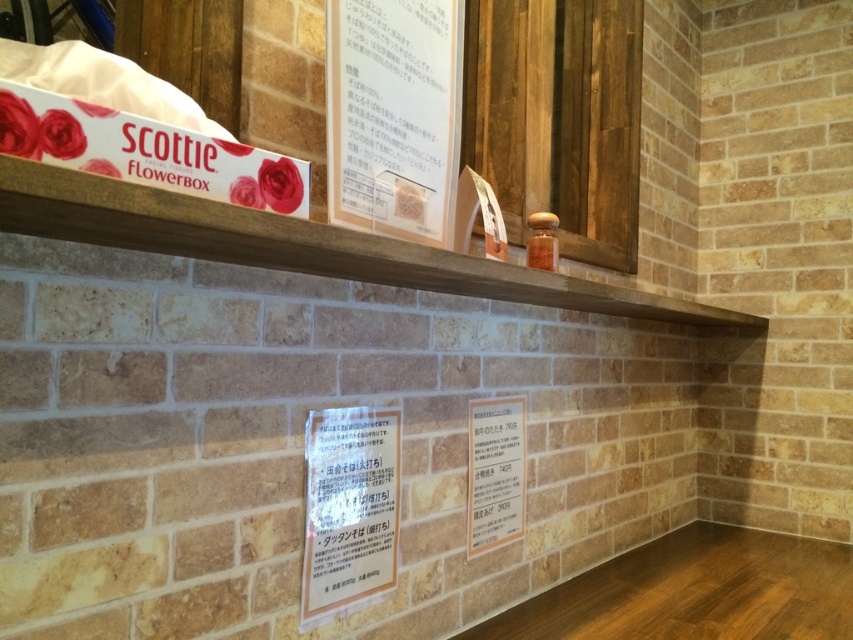
Looking at this image, you are standing in the room with the rustic brick wall. There is a wooden shelf at upper center. If you were to place a small decorative item at the point with coordinates (300, 244), where would it be placed?

The point (300, 244) corresponds to the wooden shelf at upper center, so placing the item there would position it on the wooden shelf at upper center.

You are an interior designer planning to hang a decorative mirror that is 10 inches wide between the wooden shelf at upper center and the white paper at upper center. Can the mirror fit in the space between them without overlapping either object?

The wooden shelf at upper center and white paper at upper center are 11.17 inches apart. Since the mirror is 10 inches wide, it can fit between them without overlapping either object as there is enough space.

You are a delivery person who needs to place a small package between the white paper at upper center and the white paper sign at center. Can you fit it there?

The distance between the white paper at upper center and the white paper sign at center is 17.88 inches, so yes, the small package can be placed there as there is sufficient space.